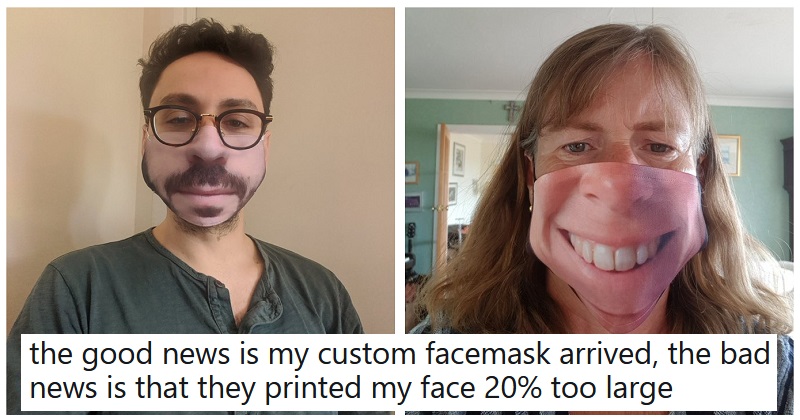
Identify the location of picture. This screenshot has height=420, width=800. [x=732, y=164], [x=410, y=174], [x=454, y=160], [x=454, y=196], [x=477, y=190], [x=410, y=198].